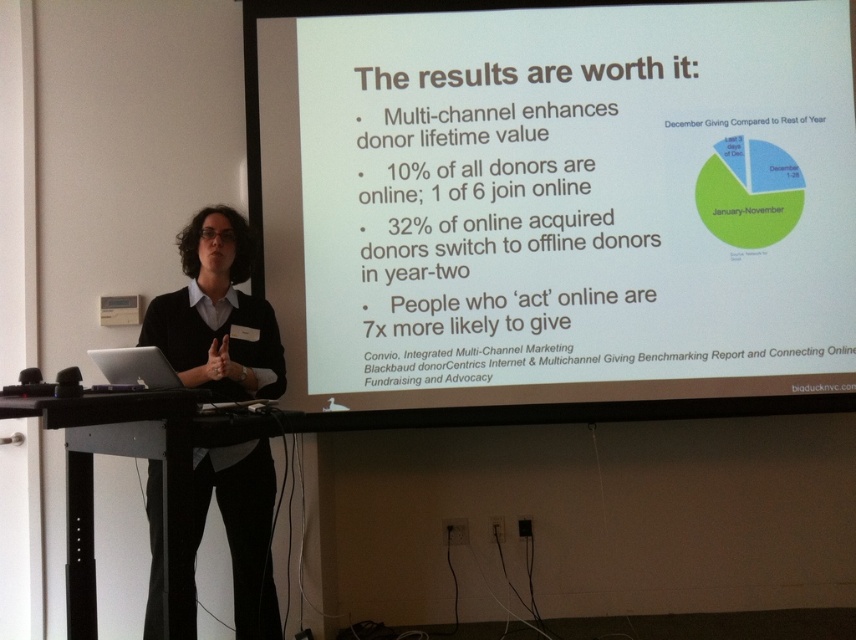
Is white matte projection screen at upper center below black matte sweater at center?

Incorrect, white matte projection screen at upper center is not positioned below black matte sweater at center.

Looking at this image, does white matte projection screen at upper center appear on the left side of black matte sweater at center?

In fact, white matte projection screen at upper center is to the right of black matte sweater at center.

At what (x,y) coordinates should I click in order to perform the action: click on white matte projection screen at upper center. Please return your answer as a coordinate pair (x, y). The width and height of the screenshot is (856, 640). Looking at the image, I should click on (553, 198).

Is white matte projection screen at upper center behind silver metallic laptop at lower left?

Yes, it is.

Can you confirm if white matte projection screen at upper center is wider than silver metallic laptop at lower left?

Yes.

Does point (752, 150) come farther from viewer compared to point (155, 348)?

Yes, point (752, 150) is farther from viewer.

This screenshot has width=856, height=640. I want to click on white matte projection screen at upper center, so click(x=553, y=198).

Which is more to the left, black matte sweater at center or silver metallic laptop at lower left?

silver metallic laptop at lower left

Does black matte sweater at center have a larger size compared to silver metallic laptop at lower left?

Yes, black matte sweater at center is bigger than silver metallic laptop at lower left.

Is point (217, 246) positioned before point (173, 380)?

No, it is not.

Identify the location of black matte sweater at center. The image size is (856, 640). (217, 314).